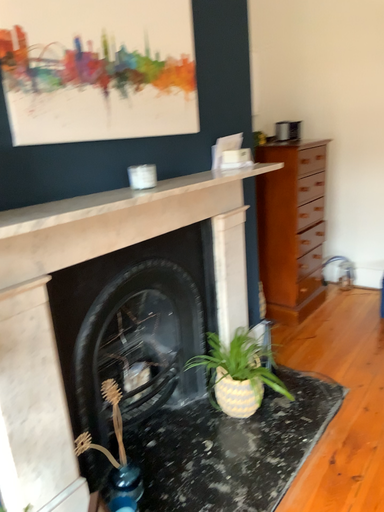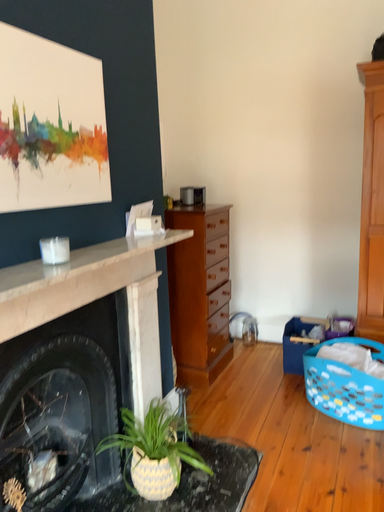
Question: How did the camera likely rotate when shooting the video?

Choices:
 (A) rotated right
 (B) rotated left

Answer: (A)